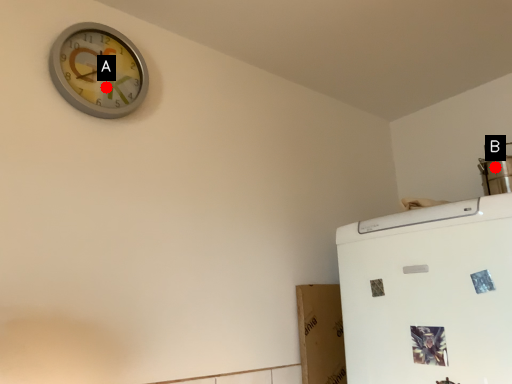
Question: Two points are circled on the image, labeled by A and B beside each circle. Which of the following is the farthest from the observer?

Choices:
 (A) A is further
 (B) B is further

Answer: (B)